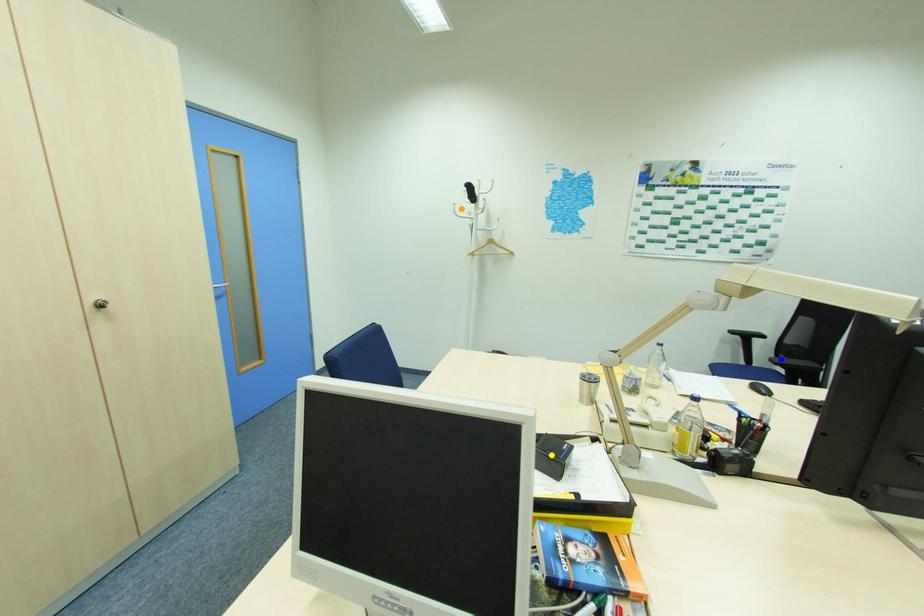
Order these from nearest to farthest:
- orange point
- blue point
- yellow point

yellow point < blue point < orange point